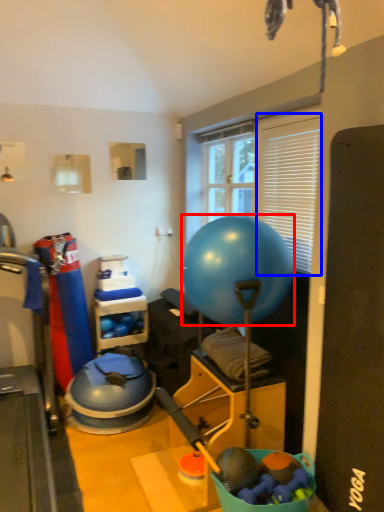
Question: Which point is further to the camera, ball (highlighted by a red box) or window screen (highlighted by a blue box)?

Choices:
 (A) ball
 (B) window screen

Answer: (B)